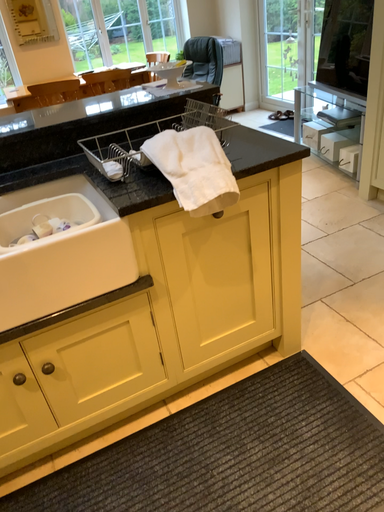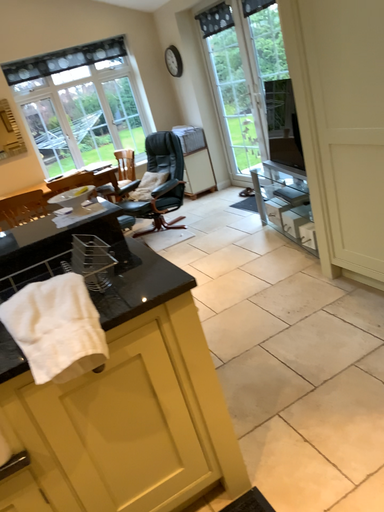
Question: Which way did the camera rotate in the video?

Choices:
 (A) rotated downward
 (B) rotated upward

Answer: (B)